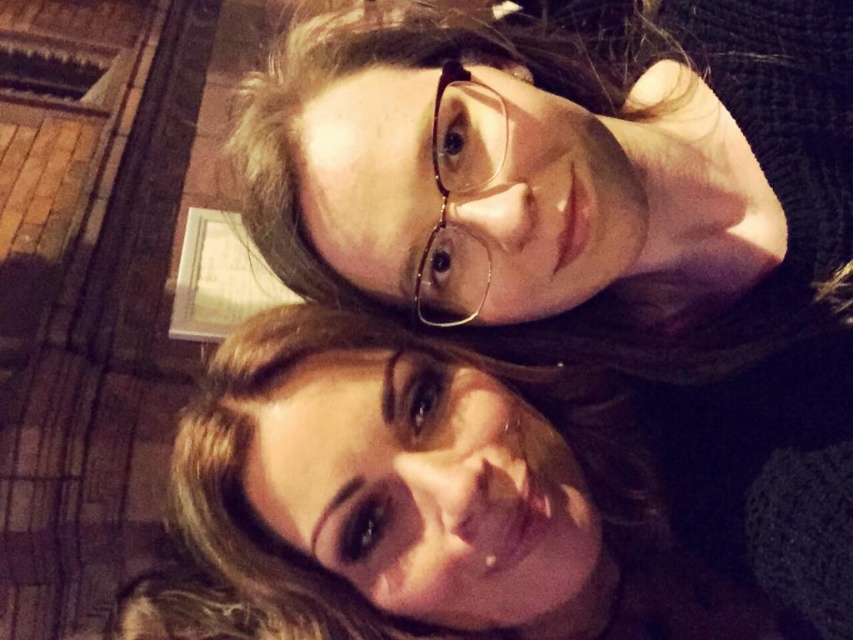
Question: Does matte black glasses at upper center have a larger size compared to smooth brown hair at center?

Choices:
 (A) yes
 (B) no

Answer: (B)

Question: Which point is closer to the camera taking this photo?

Choices:
 (A) (459, 324)
 (B) (554, 77)

Answer: (A)

Question: Which point is closer to the camera taking this photo?

Choices:
 (A) (432, 134)
 (B) (671, 154)

Answer: (A)

Question: Is matte black glasses at upper center wider than smooth brown hair at center?

Choices:
 (A) no
 (B) yes

Answer: (A)

Question: Among these points, which one is nearest to the camera?

Choices:
 (A) (253, 420)
 (B) (378, 220)

Answer: (B)

Question: Can you confirm if smooth brown hair at center is bigger than clear plastic glasses at center?

Choices:
 (A) no
 (B) yes

Answer: (B)